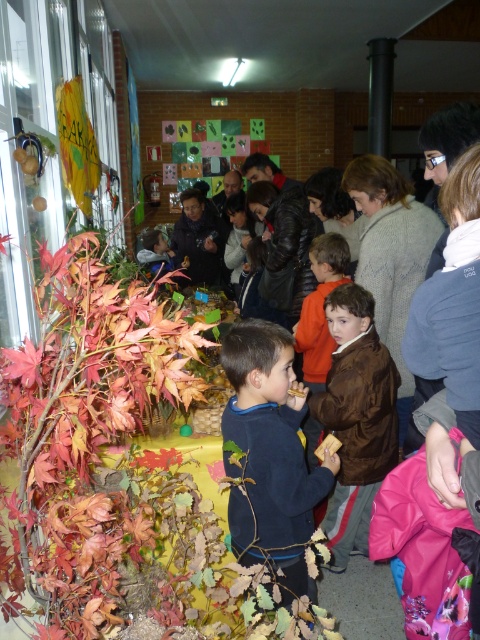
Question: Which of the following is the closest to the observer?

Choices:
 (A) dark blue sweater at center
 (B) brown fuzzy jacket at center

Answer: (A)

Question: Is autumn leaves at left further to camera compared to brown fuzzy jacket at center?

Choices:
 (A) yes
 (B) no

Answer: (B)

Question: Which of the following is the closest to the observer?

Choices:
 (A) (350, 509)
 (B) (80, 547)
 (C) (332, 458)

Answer: (B)

Question: From the image, what is the correct spatial relationship of autumn leaves at left in relation to brown fuzzy jacket at center?

Choices:
 (A) above
 (B) below

Answer: (A)

Question: In this image, where is autumn leaves at left located relative to dark blue sweater at center?

Choices:
 (A) left
 (B) right

Answer: (A)

Question: Which point is farther to the camera?

Choices:
 (A) brown fuzzy jacket at center
 (B) dark blue sweater at center
 (C) autumn leaves at left

Answer: (A)